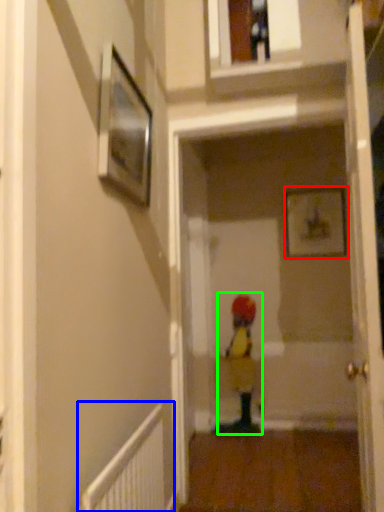
Question: Based on their relative distances, which object is nearer to picture frame (highlighted by a red box)? Choose from radiator (highlighted by a blue box) and toddler (highlighted by a green box).

Choices:
 (A) radiator
 (B) toddler

Answer: (B)